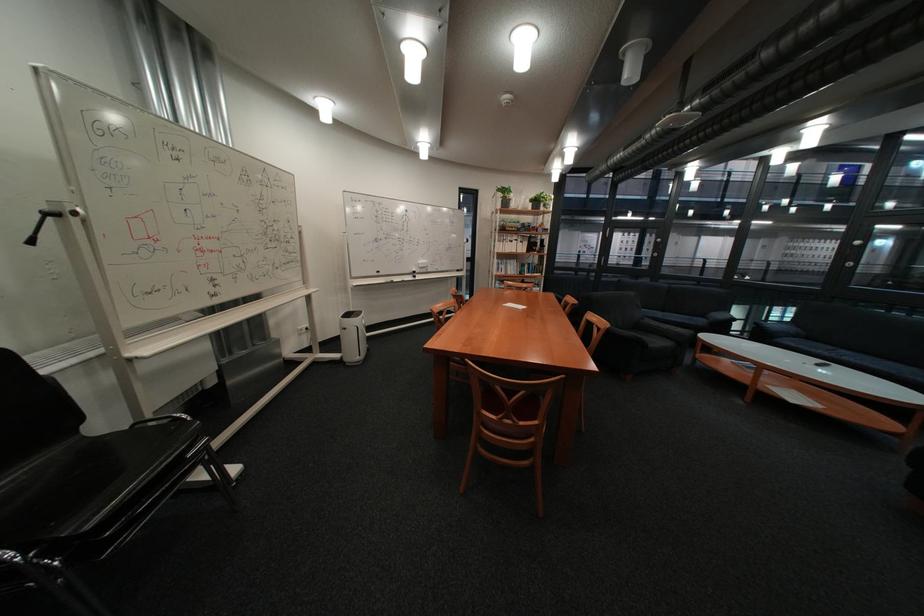
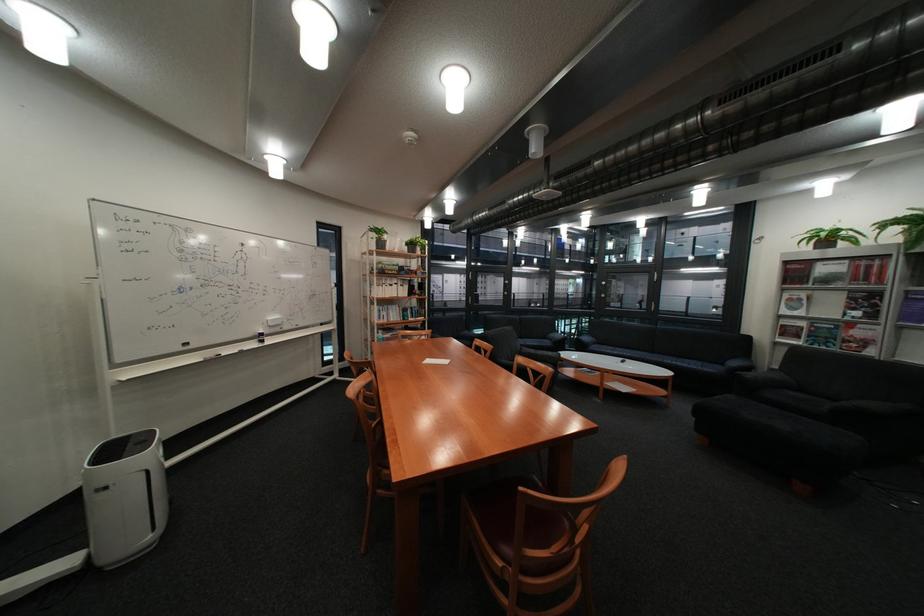
The point at (x=682, y=326) is marked in the first image. Where is the corresponding point in the second image?

(555, 353)